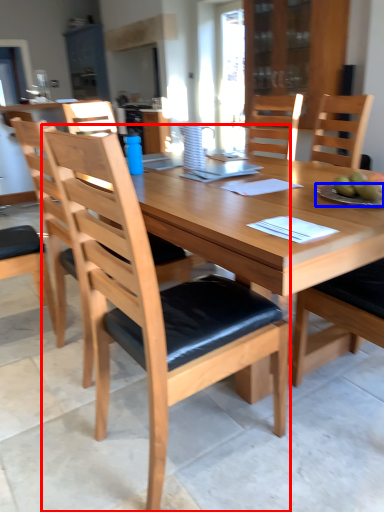
Question: Among these objects, which one is farthest to the camera, chair (highlighted by a red box) or plate (highlighted by a blue box)?

Choices:
 (A) chair
 (B) plate

Answer: (B)